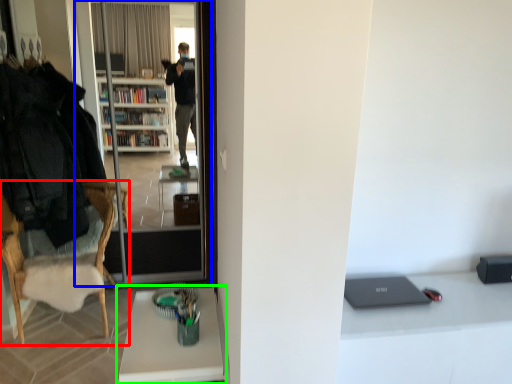
Question: Based on their relative distances, which object is nearer to chair (highlighted by a red box)? Choose from screen door (highlighted by a blue box) and desk (highlighted by a green box).

Choices:
 (A) screen door
 (B) desk

Answer: (A)